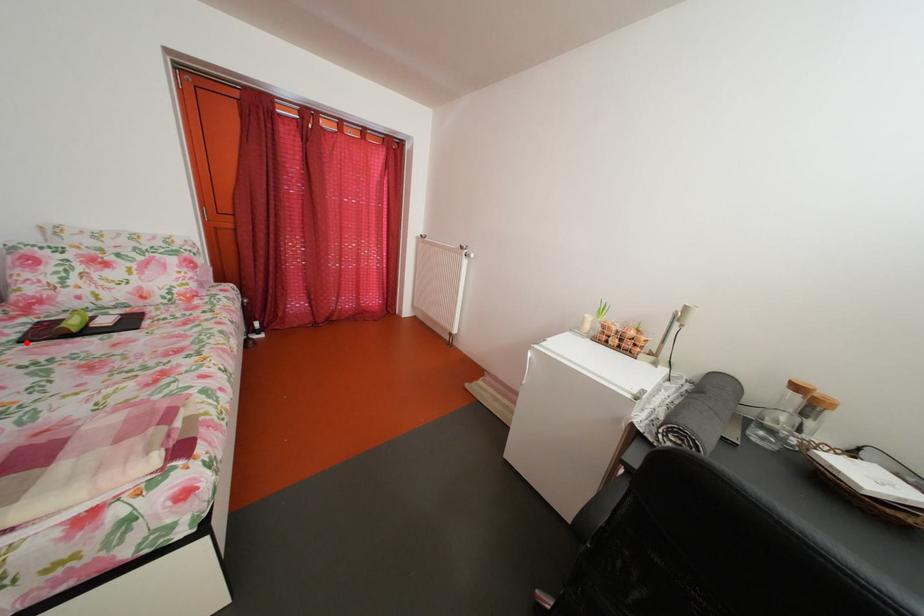
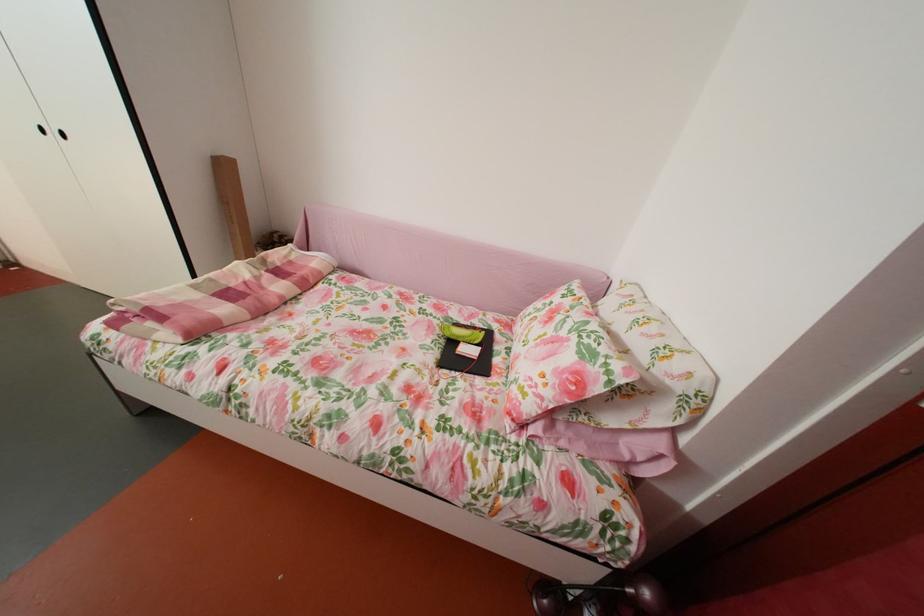
Locate, in the second image, the point that corresponds to the highlighted location in the first image.

(473, 328)